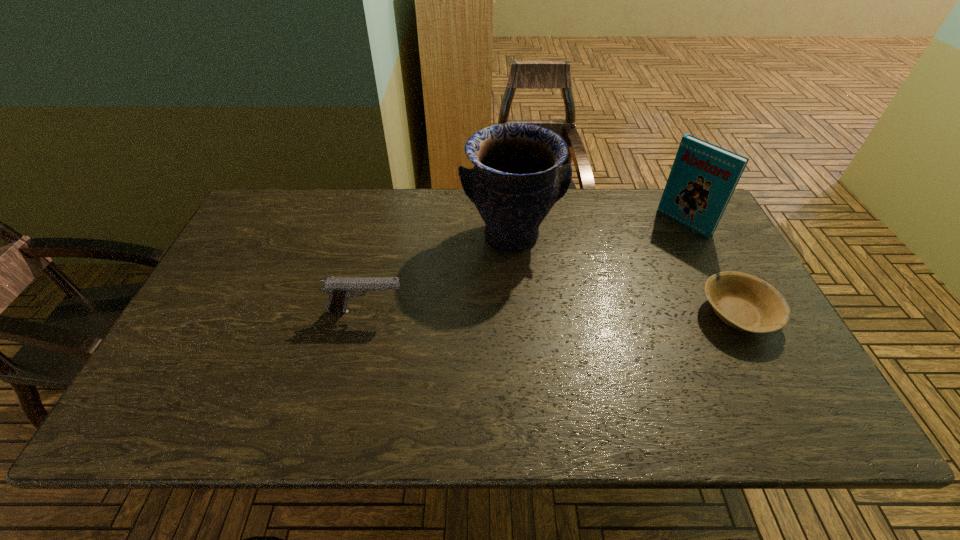
Locate an element on the screen. This screenshot has height=540, width=960. vacant region at the left edge of the desktop is located at coordinates (235, 328).

Locate an element on the screen. This screenshot has height=540, width=960. free space at the right edge of the desktop is located at coordinates (696, 239).

Identify the location of vacant position at the far left corner of the desktop. This screenshot has width=960, height=540. (282, 220).

Where is `empty location between the second object from left to right and the leftmost object`? This screenshot has height=540, width=960. empty location between the second object from left to right and the leftmost object is located at coordinates (439, 273).

Find the location of a particular element. vacant region between the shortest object and the book is located at coordinates (710, 268).

Locate an element on the screen. vacant area between the shortest object and the pistol is located at coordinates (552, 313).

You are a GUI agent. You are given a task and a screenshot of the screen. Output one action in this format:
    pyautogui.click(x=<x>, y=<y>)
    Task: Click on the vacant area that lies between the shortest object and the second object from left to right
    The height and width of the screenshot is (540, 960).
    Given the screenshot: What is the action you would take?
    pyautogui.click(x=624, y=275)

Find the location of a particular element. The image size is (960, 540). vacant space that's between the third object from right to left and the book is located at coordinates (597, 229).

What are the coordinates of `unoccupied position between the pottery and the pistol` in the screenshot? It's located at (439, 273).

Where is `free space between the third object from right to left and the shortest object`? This screenshot has height=540, width=960. free space between the third object from right to left and the shortest object is located at coordinates (624, 275).